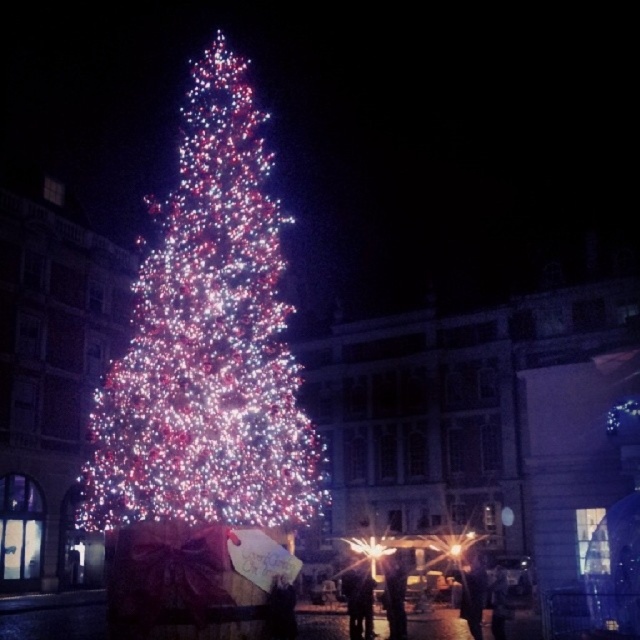
Question: Can you confirm if illuminated plastic christmas tree at center is positioned to the left of denim pants at center?

Choices:
 (A) yes
 (B) no

Answer: (A)

Question: Can you confirm if illuminated plastic christmas tree at center is positioned below denim pants at center?

Choices:
 (A) no
 (B) yes

Answer: (A)

Question: Among these objects, which one is nearest to the camera?

Choices:
 (A) dark fabric coat at lower center
 (B) dark fabric coat at lower right

Answer: (B)

Question: Can you confirm if dark fabric coat at lower center is thinner than dark fabric coat at lower right?

Choices:
 (A) yes
 (B) no

Answer: (A)

Question: Which point is closer to the camera?

Choices:
 (A) (355, 605)
 (B) (472, 580)
 (C) (141, 326)

Answer: (C)

Question: Which point is farther from the camera taking this photo?

Choices:
 (A) pyautogui.click(x=484, y=582)
 (B) pyautogui.click(x=285, y=436)

Answer: (A)